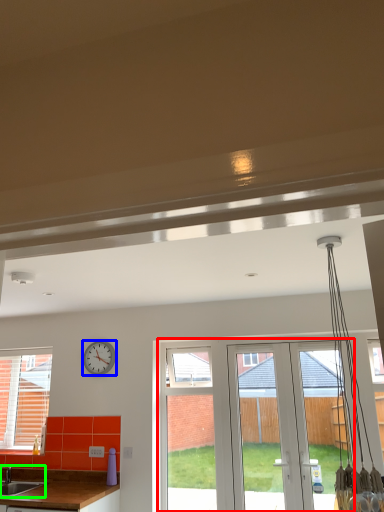
Question: Estimate the real-world distances between objects in this image. Which object is closer to screen door (highlighted by a red box), clock (highlighted by a blue box) or sink (highlighted by a green box)?

Choices:
 (A) clock
 (B) sink

Answer: (A)